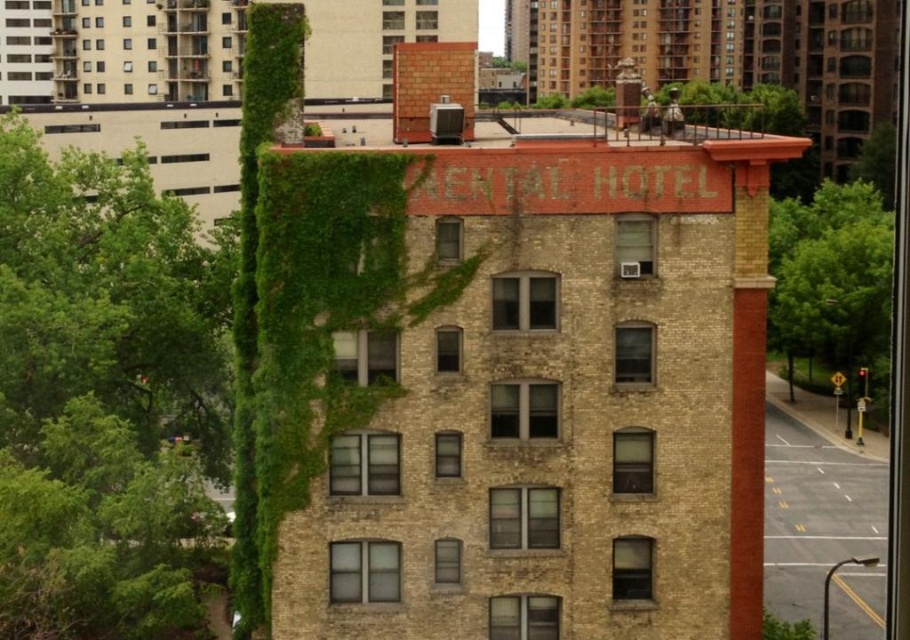
Can you confirm if green leafy tree at left is thinner than green leafy tree at right?

Yes.

Which is in front, point (191, 388) or point (853, 307)?

Point (191, 388)

Where is `green leafy tree at left`? Image resolution: width=910 pixels, height=640 pixels. green leafy tree at left is located at coordinates (106, 397).